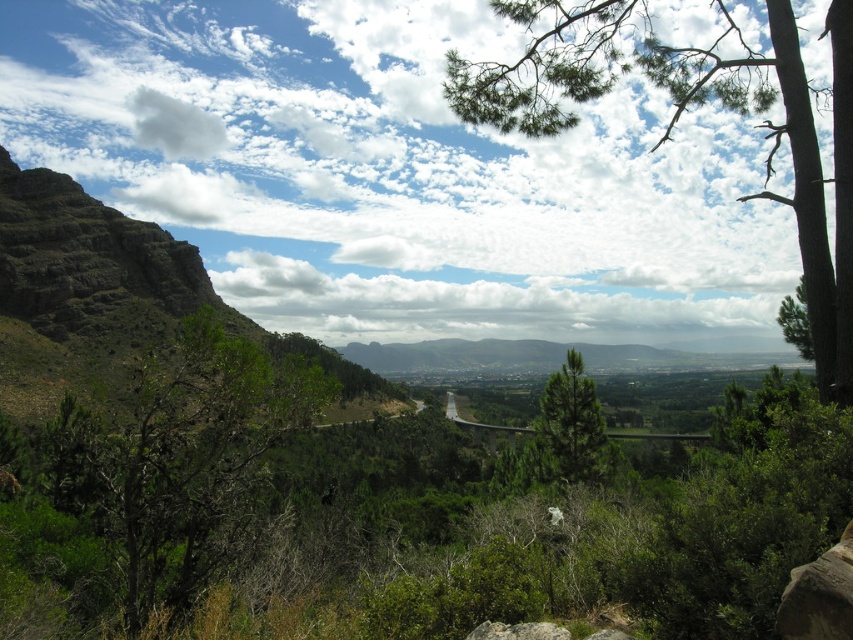
Question: Does green leafy tree at left appear on the left side of green textured tree at center?

Choices:
 (A) no
 (B) yes

Answer: (B)

Question: Is green leafy tree at left thinner than gray rough rock at lower center?

Choices:
 (A) yes
 (B) no

Answer: (B)

Question: Based on their relative distances, which object is farther from the green textured pine tree at right?

Choices:
 (A) green leafy tree at left
 (B) green leafy tree at upper right
 (C) green textured tree at center

Answer: (C)

Question: Which point appears closest to the camera in this image?

Choices:
 (A) tap(148, 376)
 (B) tap(842, 352)

Answer: (B)

Question: Can you confirm if green leafy tree at upper right is positioned below white fluffy cloud at upper center?

Choices:
 (A) yes
 (B) no

Answer: (A)

Question: Estimate the real-world distances between objects in this image. Which object is farther from the green leafy tree at upper right?

Choices:
 (A) white fluffy cloud at upper center
 (B) green textured pine tree at right
 (C) gray rough rock at lower center

Answer: (A)